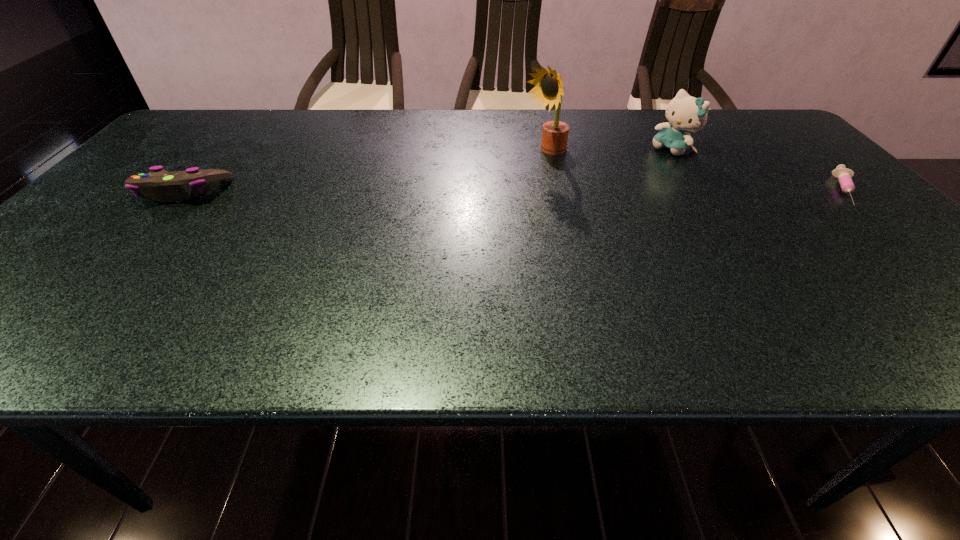
At what (x,y) coordinates should I click in order to perform the action: click on vacant region located 0.130m on the face of the sunflower. Please return your answer as a coordinate pair (x, y). Image resolution: width=960 pixels, height=540 pixels. Looking at the image, I should click on (497, 179).

Identify the location of vacant area situated on the face of the sunflower. (505, 175).

This screenshot has width=960, height=540. What are the coordinates of `vacant space located on the face of the sunflower` in the screenshot? It's located at (516, 170).

At what (x,y) coordinates should I click in order to perform the action: click on vacant space located 0.150m on the face of the third object from left to right. Please return your answer as a coordinate pair (x, y). The width and height of the screenshot is (960, 540). Looking at the image, I should click on (629, 174).

Where is `free space located 0.260m on the face of the third object from left to right`? free space located 0.260m on the face of the third object from left to right is located at coordinates (604, 190).

At what (x,y) coordinates should I click in order to perform the action: click on free location located on the face of the third object from left to right. Please return your answer as a coordinate pair (x, y). The image size is (960, 540). Looking at the image, I should click on (642, 166).

The width and height of the screenshot is (960, 540). I want to click on sunflower located in the far edge section of the desktop, so click(548, 88).

Find the location of a particular element. This screenshot has height=540, width=960. kitten present at the far edge is located at coordinates (685, 113).

The width and height of the screenshot is (960, 540). Find the location of `object at the left edge`. object at the left edge is located at coordinates (159, 184).

At what (x,y) coordinates should I click in order to perform the action: click on object present at the right edge. Please return your answer as a coordinate pair (x, y). The height and width of the screenshot is (540, 960). Looking at the image, I should click on (844, 175).